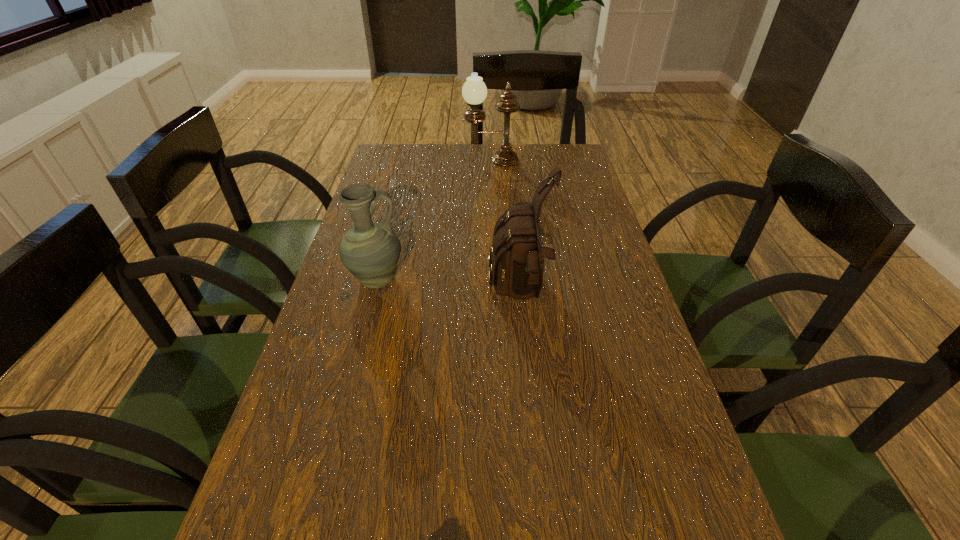
Where is `oil lamp`? oil lamp is located at coordinates (474, 91).

Where is `shoulder bag`? Image resolution: width=960 pixels, height=540 pixels. shoulder bag is located at coordinates (517, 264).

Identify the location of pitcher. The image size is (960, 540). (370, 251).

Locate an element on the screen. The width and height of the screenshot is (960, 540). vacant region located on the front of the oil lamp is located at coordinates (493, 227).

What are the coordinates of `free location located on the front-facing side of the shoulder bag` in the screenshot? It's located at (331, 295).

Locate an element on the screen. vacant space located on the front-facing side of the shoulder bag is located at coordinates click(389, 295).

You are a GUI agent. You are given a task and a screenshot of the screen. Output one action in this format:
    pyautogui.click(x=<x>, y=<y>)
    Task: Click on the vacant space situated 0.220m on the front-facing side of the shoulder bag
    Image resolution: width=960 pixels, height=540 pixels.
    Given the screenshot: What is the action you would take?
    pyautogui.click(x=397, y=295)

At what (x,y) coordinates should I click in order to perform the action: click on vacant area located 0.120m on the handle side of the pitcher. Please return your answer as a coordinate pair (x, y). Looking at the image, I should click on (453, 280).

You are a GUI agent. You are given a task and a screenshot of the screen. Output one action in this format:
    pyautogui.click(x=<x>, y=<y>)
    Task: Click on the object present at the far edge
    This screenshot has width=960, height=540.
    Given the screenshot: What is the action you would take?
    pyautogui.click(x=474, y=91)

Where is `object that is at the left edge`? object that is at the left edge is located at coordinates (370, 251).